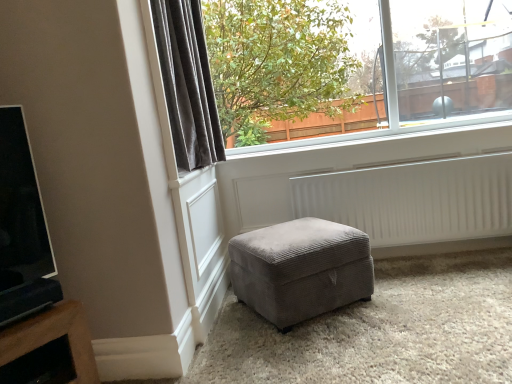
You are a GUI agent. You are given a task and a screenshot of the screen. Output one action in this format:
    pyautogui.click(x=<x>, y=<y>)
    Task: Click on the empty space that is ontop of white ribbed radiator at lower center (from a real-world perspective)
    This screenshot has height=384, width=512.
    Given the screenshot: What is the action you would take?
    pyautogui.click(x=395, y=167)